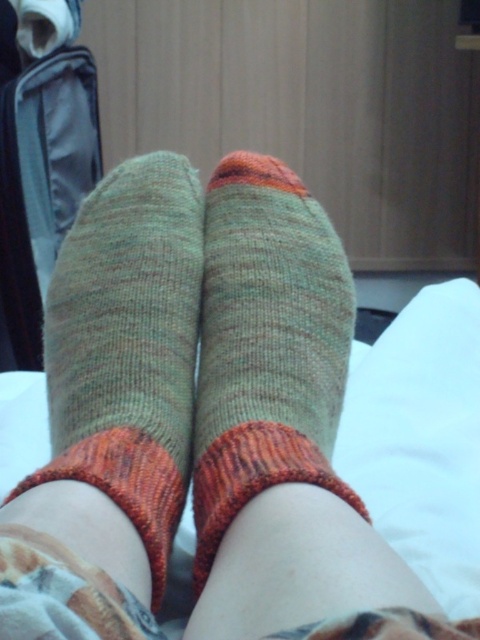
Question: Which object is closer to the camera taking this photo?

Choices:
 (A) green knitted sock at center
 (B) knitted wool socks at center

Answer: (B)

Question: Is knitted wool socks at center in front of green knitted sock at center?

Choices:
 (A) no
 (B) yes

Answer: (B)

Question: From the image, what is the correct spatial relationship of knitted wool socks at center in relation to green knitted sock at center?

Choices:
 (A) left
 (B) right

Answer: (A)

Question: Which object appears closest to the camera in this image?

Choices:
 (A) green knitted sock at center
 (B) knitted wool socks at center

Answer: (B)

Question: Can you confirm if knitted wool socks at center is thinner than green knitted sock at center?

Choices:
 (A) yes
 (B) no

Answer: (B)